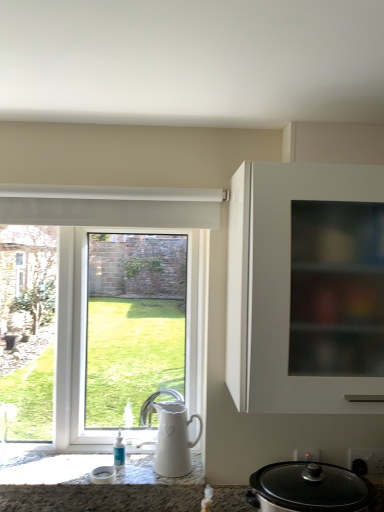
Question: Is point (54, 357) positioned closer to the camera than point (286, 477)?

Choices:
 (A) farther
 (B) closer

Answer: (A)

Question: In terms of size, does white glossy window at left appear bigger or smaller than black glass slow cooker at lower right?

Choices:
 (A) big
 (B) small

Answer: (A)

Question: Estimate the real-world distances between objects in this image. Which object is closer to the black glass slow cooker at lower right?

Choices:
 (A) white ceramic jug at lower center
 (B) white glossy window at left
 (C) white matte cabinet at right

Answer: (A)

Question: Which of these objects is positioned farthest from the white glossy window at left?

Choices:
 (A) white matte cabinet at right
 (B) white ceramic jug at lower center
 (C) black glass slow cooker at lower right

Answer: (C)